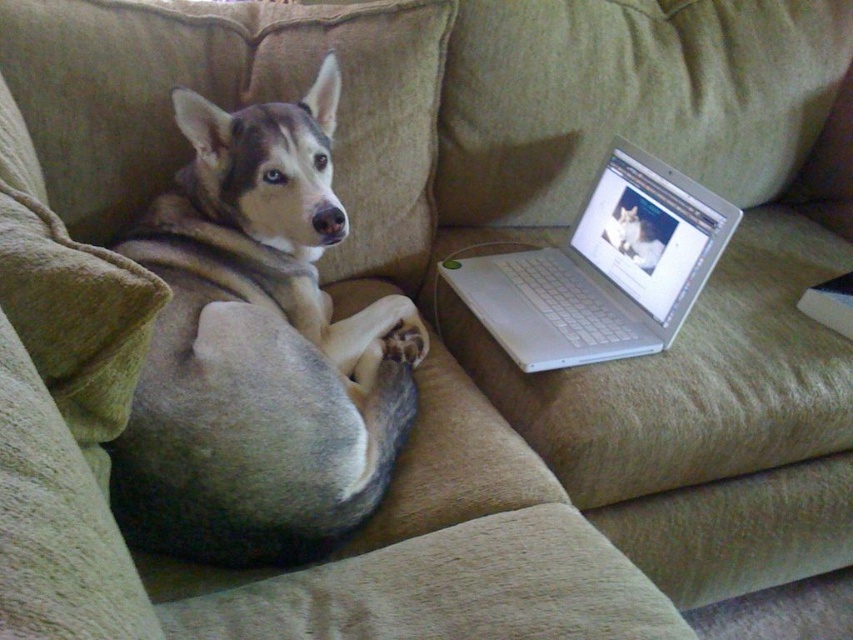
You are a delivery person who needs to place a small package between the brown fur dog at left and the silver metallic laptop at right on the couch. Considering their sizes, which object should you position closer to the edge of the couch to ensure the package fits comfortably?

The brown fur dog at left is bigger than the silver metallic laptop at right, so you should position the silver metallic laptop at right closer to the edge of the couch to make space for the package between them.

You are a photographer setting up a tripod to take a portrait of the brown fur dog at left and the silver metallic laptop at right. The tripod has a height limit of 50 cm. If the dog is taller than the laptop, will the tripod be sufficient to capture both subjects comfortably?

The brown fur dog at left has a greater height compared to the silver metallic laptop at right. Since the tripod has a height limit of 50 cm, it should be sufficient to capture both subjects as long as the dog is within that height range.